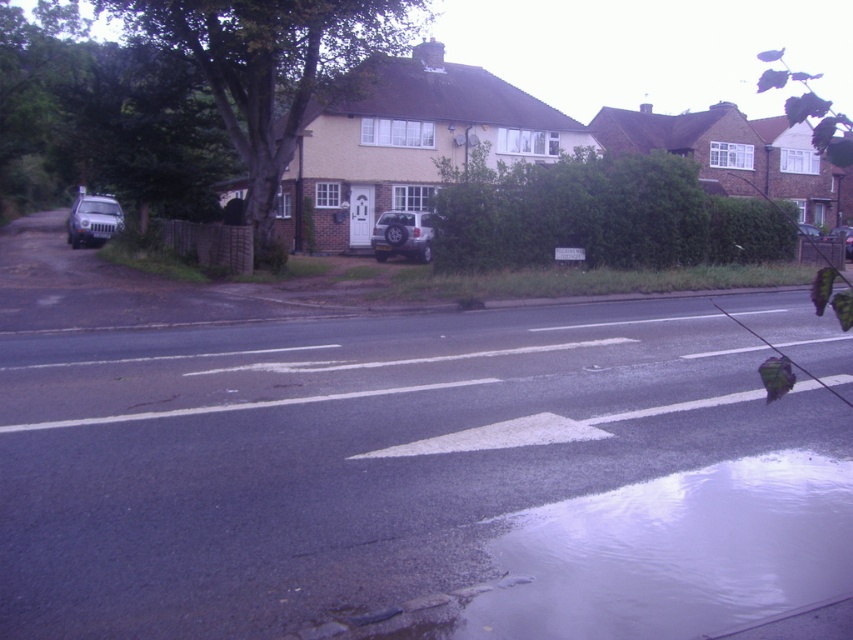
You are a delivery drone operator. Your drone is currently at the camera position and needs to deliver a package to the point marked as point [19,356]. Can your drone reach this point if its maximum flight distance is 10 meters?

The distance between the camera and point [19,356] is 11.26 meters, which exceeds the drone operator stated maximum flight distance of 10 meters. Therefore, the drone cannot reach the point.

You are a pedestrian standing on the sidewalk and want to cross the road to reach the metallic silver car at center. Is the clear water at lower right between you and the car?

Yes, the clear water at lower right is between you and the metallic silver car at center because it is closer to the viewer than the car.

You are a drone operator trying to capture aerial footage of the residential street scene. You have two points marked on your screen, point (657, 624) and point (844, 237). Which point should you focus on first if you want to capture the closest part of the scene first?

Point (657, 624) is closer to the camera than point (844, 237), so you should focus on point (657, 624) first to capture the closest part of the scene.